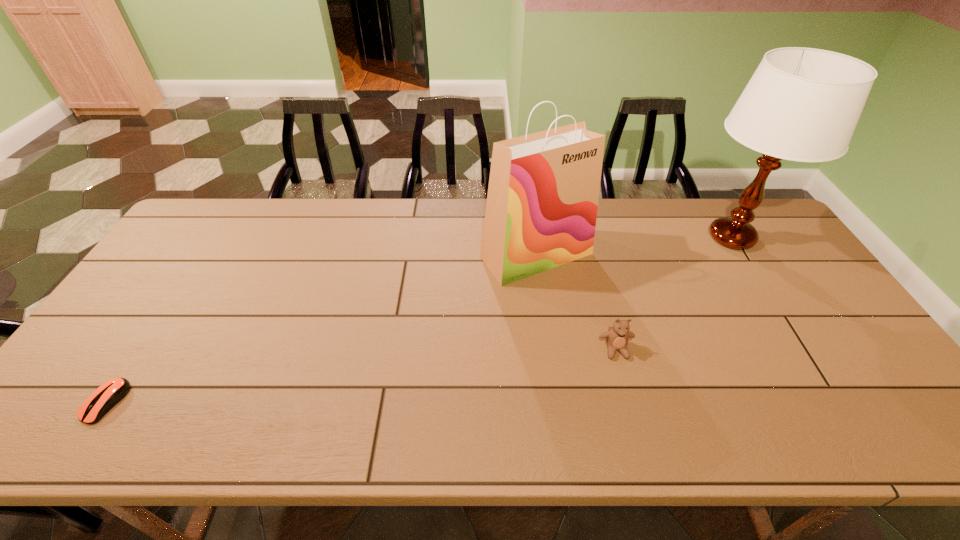
Identify the location of free region at the right edge of the desktop. This screenshot has height=540, width=960. (759, 284).

At what (x,y) coordinates should I click in order to perform the action: click on vacant space at the near left corner. Please return your answer as a coordinate pair (x, y). This screenshot has height=540, width=960. Looking at the image, I should click on (44, 417).

The height and width of the screenshot is (540, 960). Identify the location of free space between the shopping bag and the second shortest object. (576, 302).

The width and height of the screenshot is (960, 540). What are the coordinates of `unoccupied area between the second nearest object and the shopping bag` in the screenshot? It's located at (576, 302).

You are a GUI agent. You are given a task and a screenshot of the screen. Output one action in this format:
    pyautogui.click(x=<x>, y=<y>)
    Task: Click on the free space between the rightmost object and the teddy bear
    This screenshot has height=540, width=960.
    Given the screenshot: What is the action you would take?
    pyautogui.click(x=674, y=294)

This screenshot has width=960, height=540. In order to click on free space between the table lamp and the computer mouse in this screenshot , I will do `click(419, 320)`.

You are a GUI agent. You are given a task and a screenshot of the screen. Output one action in this format:
    pyautogui.click(x=<x>, y=<y>)
    Task: Click on the free spot between the shopping bag and the nearest object
    The width and height of the screenshot is (960, 540).
    Given the screenshot: What is the action you would take?
    pyautogui.click(x=322, y=329)

Find the location of a particular element. Image resolution: width=960 pixels, height=540 pixels. unoccupied area between the shopping bag and the second nearest object is located at coordinates (576, 302).

Locate an element on the screen. This screenshot has height=540, width=960. free space between the nearest object and the rightmost object is located at coordinates (419, 320).

Identify the location of vacant point located between the third tallest object and the shopping bag. (576, 302).